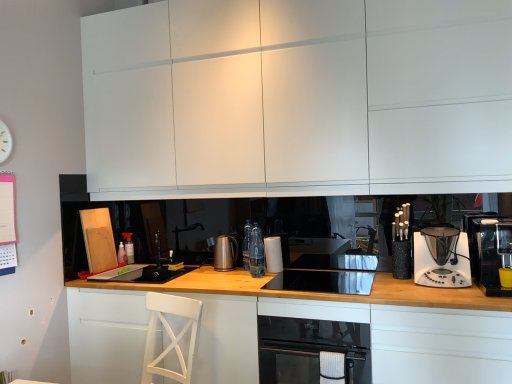
Question: Is point (207, 112) positioned closer to the camera than point (467, 256)?

Choices:
 (A) closer
 (B) farther

Answer: (B)

Question: Considering the positions of white matte cabinet at upper center, positioned as the 3th cabinetry in bottom-to-top order, and white plastic blender at right, acting as the 2th kitchen appliance starting from the left, in the image, is white matte cabinet at upper center, positioned as the 3th cabinetry in bottom-to-top order, taller or shorter than white plastic blender at right, acting as the 2th kitchen appliance starting from the left,?

Choices:
 (A) tall
 (B) short

Answer: (A)

Question: Considering the real-world distances, which object is farthest from the white matte cabinet at lower left, the 3th cabinetry in the top-to-bottom sequence?

Choices:
 (A) black glass cooktop at center
 (B) white plastic blender at right, acting as the 2th kitchen appliance starting from the right
 (C) black glass oven at lower center
 (D) white plastic clock at upper left
 (E) white matte cabinet at upper center, which is the first cabinetry in top-to-bottom order

Answer: (D)

Question: Which object is the farthest from the black glass cooktop at center?

Choices:
 (A) white plastic clock at upper left
 (B) black glass oven at lower center
 (C) white matte cabinet at lower left, which appears as the second cabinetry when viewed from the top
 (D) white plastic blender at right, acting as the 2th kitchen appliance starting from the left
 (E) black plastic coffee machine at right, the 3th kitchen appliance when ordered from back to front

Answer: (A)